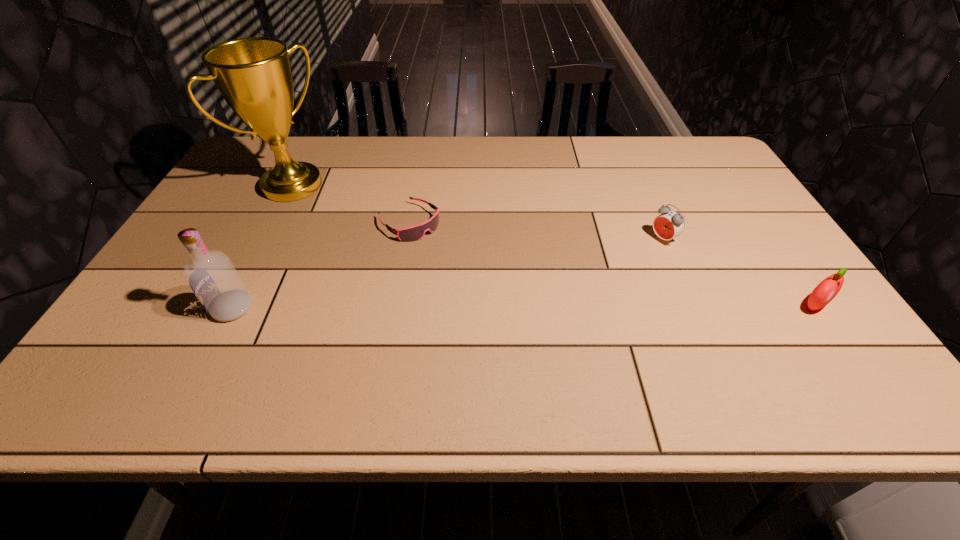
The image size is (960, 540). Identify the location of object present at the left edge. (253, 74).

Image resolution: width=960 pixels, height=540 pixels. Find the location of `object positioned at the right edge`. object positioned at the right edge is located at coordinates (826, 290).

At what (x,y) coordinates should I click in order to perform the action: click on object present at the far left corner. Please return your answer as a coordinate pair (x, y). Looking at the image, I should click on point(253,74).

I want to click on blank area at the far edge, so click(633, 144).

Image resolution: width=960 pixels, height=540 pixels. Find the location of `free space at the near edge of the desktop`. free space at the near edge of the desktop is located at coordinates coord(633,328).

You are a GUI agent. You are given a task and a screenshot of the screen. Output one action in this format:
    pyautogui.click(x=<x>, y=<y>)
    Task: Click on the vacant region at the left edge of the desktop
    The width and height of the screenshot is (960, 540).
    Given the screenshot: What is the action you would take?
    pyautogui.click(x=237, y=241)

Identify the location of blank space at the right edge of the desktop. (763, 261).

The width and height of the screenshot is (960, 540). Identify the location of vacant position at the far left corner of the desktop. (255, 163).

The width and height of the screenshot is (960, 540). I want to click on blank area at the near left corner, so click(x=123, y=352).

You are a GUI agent. You are given a task and a screenshot of the screen. Output one action in this format:
    pyautogui.click(x=<x>, y=<y>)
    Task: Click on the free region at the far right corner
    The image size is (960, 540).
    Given the screenshot: What is the action you would take?
    pyautogui.click(x=703, y=161)